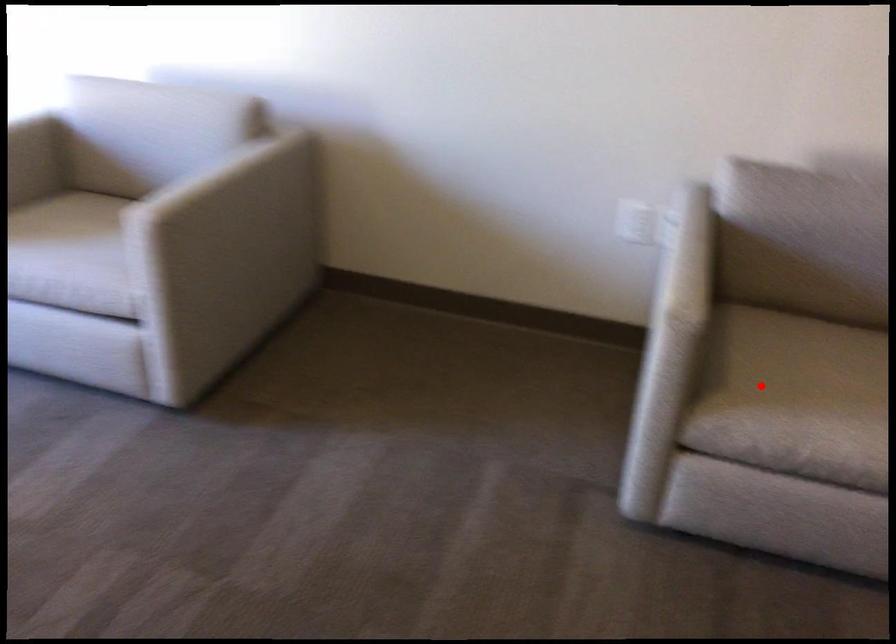
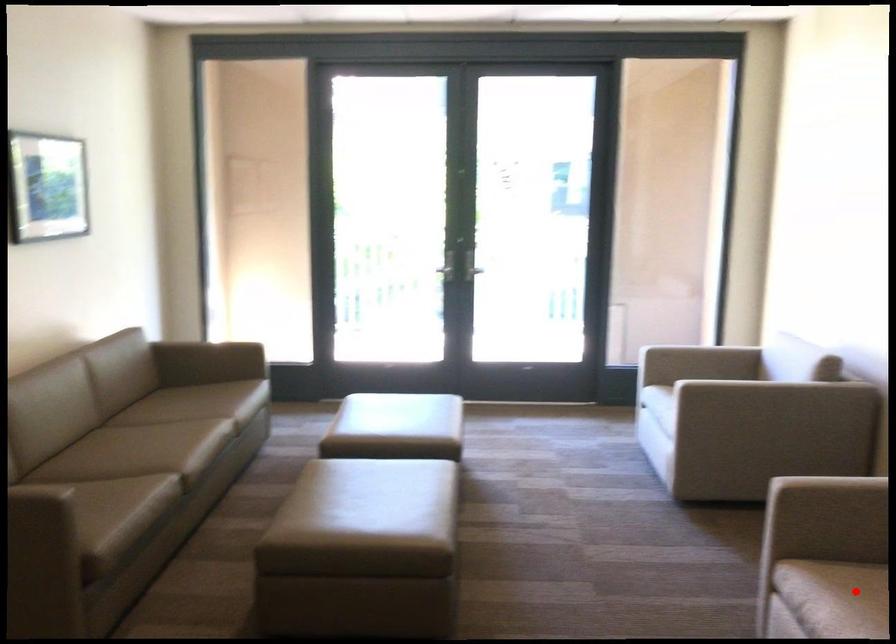
I am providing you with two images of the same scene from different viewpoints. A red point is marked on the first image and another point is marked on the second image. Do the highlighted points in image1 and image2 indicate the same real-world spot?

Yes